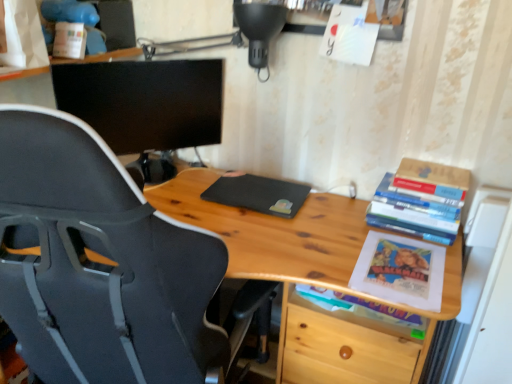
The image size is (512, 384). In order to click on empty space that is ontop of black matte monitor at upper left (from a real-world perspective) in this screenshot , I will do `click(128, 64)`.